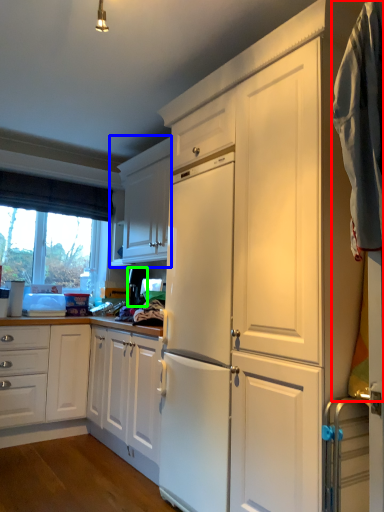
Question: Which object is positioned farthest from laundry (highlighted by a red box)? Select from cabinetry (highlighted by a blue box) and appliance (highlighted by a green box).

Choices:
 (A) cabinetry
 (B) appliance

Answer: (A)